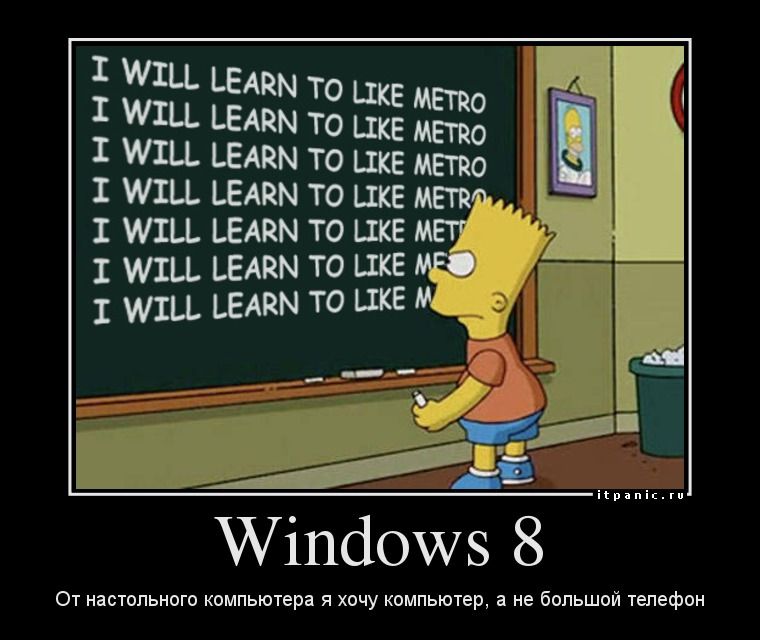
The height and width of the screenshot is (640, 760). Identify the location of chalkboard. (248, 337).